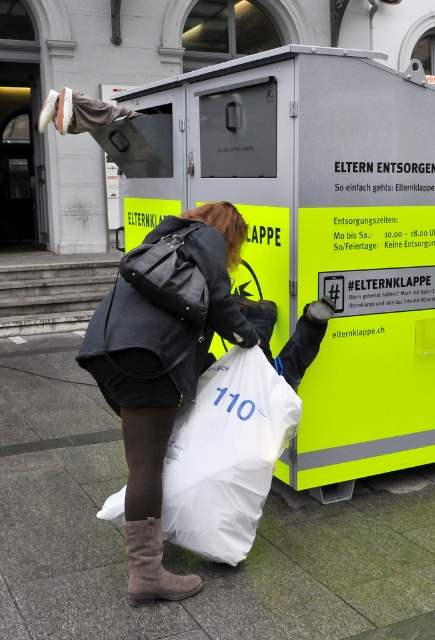
You are a delivery person who needs to place a package in the recycling station. You see a white plastic bag at lower center and a brown suede boot at lower left. Which object is closer to you?

The white plastic bag at lower center is closer to you because the brown suede boot at lower left is behind it.

You are standing at the ELTERNKLAPPE recycling station. You need to place your items into the station. Where is the matte black jacket at center located relative to the station?

The matte black jacket at center is located at point 0.567 in the x coordinate and 0.377 in the y coordinate relative to the station.

You are a delivery person who just arrived at the ELTERNKLAPPE recycling station. You need to place a neon yellow plastic container at center into the correct bin. According to the station layout, where should you place it?

The neon yellow plastic container at center should be placed into the bin corresponding to its color and type, likely the recycling bin designated for plastic containers. Since the station is labeled and has operating hours, check the provided information on the station for specific instructions on plastic container disposal.